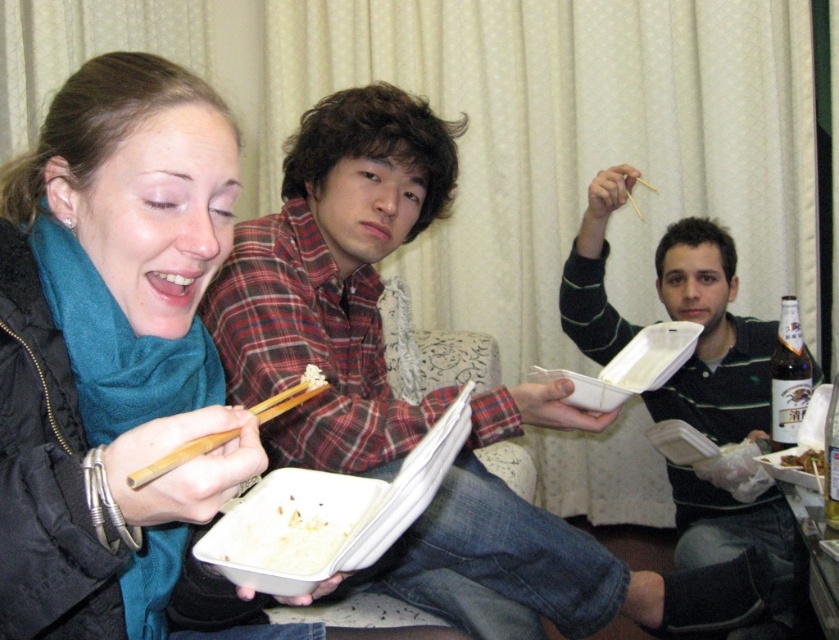
You are a guest at this gathering and want to reach for the wooden chopstick at upper right without disturbing the green leafy vegetables at center. Can you estimate if there is enough space between them to move your hand?

The green leafy vegetables at center has a lesser width compared to wooden chopstick at upper right, so there might be sufficient space to move your hand between them without disturbing the vegetables.

You are a guest at this gathering and want to reach for the wooden chopstick at upper right without disturbing the green leafy vegetables at center. Can you estimate if the chopstick is taller than the vegetables?

The green leafy vegetables at center has a lesser height compared to wooden chopstick at upper right, so yes, the wooden chopstick at upper right is taller than the green leafy vegetables at center.

You are a photographer trying to capture a closeup of the striped cotton shirt at center and the wooden chopsticks at left. Given that the shirt is larger than the chopsticks, which object should you zoom in on first to ensure both are in focus?

Since the striped cotton shirt at center is larger than the wooden chopsticks at left, you should zoom in on the striped cotton shirt at center first to ensure it fills the frame appropriately before adjusting focus for the smaller chopsticks.